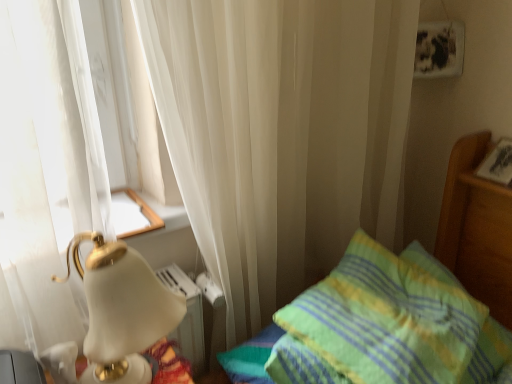
Measure the distance between point (426, 378) and camera.

Point (426, 378) is 33.23 inches from camera.

Identify the location of green/yellow striped pillow at right. Image resolution: width=512 pixels, height=384 pixels. (388, 324).

The width and height of the screenshot is (512, 384). What do you see at coordinates (388, 324) in the screenshot? I see `green/yellow striped pillow at right` at bounding box center [388, 324].

Describe the element at coordinates (121, 307) in the screenshot. The width and height of the screenshot is (512, 384). I see `white glossy lamp at left` at that location.

Find the location of a particular element. The image size is (512, 384). white glossy lamp at left is located at coordinates (121, 307).

You are a GUI agent. You are given a task and a screenshot of the screen. Output one action in this format:
    pyautogui.click(x=<x>, y=<y>)
    Task: Click on the green/yellow striped pillow at right
    This screenshot has height=384, width=512.
    Given the screenshot: What is the action you would take?
    pyautogui.click(x=388, y=324)

Is green/yellow striped pillow at right at the right side of white glossy lamp at left?

Indeed, green/yellow striped pillow at right is positioned on the right side of white glossy lamp at left.

Is green/yellow striped pillow at right further to camera compared to white glossy lamp at left?

Yes, green/yellow striped pillow at right is further from the viewer.

Which is in front, point (460, 374) or point (105, 379)?

The point (105, 379) is in front.

From the image's perspective, does green/yellow striped pillow at right appear lower than white glossy lamp at left?

Yes.

From a real-world perspective, is green/yellow striped pillow at right on top of white glossy lamp at left?

No, from a real-world perspective, green/yellow striped pillow at right is not above white glossy lamp at left.

Considering the sizes of green/yellow striped pillow at right and white glossy lamp at left in the image, is green/yellow striped pillow at right wider or thinner than white glossy lamp at left?

In the image, green/yellow striped pillow at right appears to be wider than white glossy lamp at left.

Between green/yellow striped pillow at right and white glossy lamp at left, which one has less height?

green/yellow striped pillow at right.

Considering the relative sizes of green/yellow striped pillow at right and white glossy lamp at left in the image provided, is green/yellow striped pillow at right bigger than white glossy lamp at left?

Indeed, green/yellow striped pillow at right has a larger size compared to white glossy lamp at left.

Is green/yellow striped pillow at right inside the boundaries of white glossy lamp at left, or outside?

green/yellow striped pillow at right is outside white glossy lamp at left.

Is green/yellow striped pillow at right far away from white glossy lamp at left?

Actually, green/yellow striped pillow at right and white glossy lamp at left are a little close together.

Is green/yellow striped pillow at right positioned with its back to white glossy lamp at left?

No, green/yellow striped pillow at right's orientation is not away from white glossy lamp at left.

Measure the distance from green/yellow striped pillow at right to white glossy lamp at left.

green/yellow striped pillow at right is 18.35 inches from white glossy lamp at left.

In order to click on lamp above the green/yellow striped pillow at right (from the image's perspective) in this screenshot , I will do `click(121, 307)`.

Does white glossy lamp at left appear on the right side of green/yellow striped pillow at right?

Incorrect, white glossy lamp at left is not on the right side of green/yellow striped pillow at right.

Is white glossy lamp at left in front of or behind green/yellow striped pillow at right in the image?

white glossy lamp at left is positioned closer to the viewer than green/yellow striped pillow at right.

Is point (93, 276) farther from viewer compared to point (391, 348)?

No, (93, 276) is in front of (391, 348).

From the image's perspective, is white glossy lamp at left under green/yellow striped pillow at right?

Actually, white glossy lamp at left appears above green/yellow striped pillow at right in the image.

From a real-world perspective, which object rests below the other?

green/yellow striped pillow at right is physically lower.

In the scene shown: Does white glossy lamp at left have a lesser width compared to green/yellow striped pillow at right?

Correct, the width of white glossy lamp at left is less than that of green/yellow striped pillow at right.

Considering the sizes of white glossy lamp at left and green/yellow striped pillow at right in the image, is white glossy lamp at left taller or shorter than green/yellow striped pillow at right?

In the image, white glossy lamp at left appears to be taller than green/yellow striped pillow at right.

Between white glossy lamp at left and green/yellow striped pillow at right, which one has larger size?

With larger size is green/yellow striped pillow at right.

Is white glossy lamp at left surrounding green/yellow striped pillow at right?

No, green/yellow striped pillow at right is located outside of white glossy lamp at left.

Are white glossy lamp at left and green/yellow striped pillow at right far apart?

No, white glossy lamp at left is not far from green/yellow striped pillow at right.

Is white glossy lamp at left aimed at green/yellow striped pillow at right?

No, white glossy lamp at left is not oriented towards green/yellow striped pillow at right.

How far apart are white glossy lamp at left and green/yellow striped pillow at right?

The distance of white glossy lamp at left from green/yellow striped pillow at right is 18.35 inches.

In the image, there is a green/yellow striped pillow at right. At what (x,y) coordinates should I click in order to perform the action: click on lamp above it (from the image's perspective). Please return your answer as a coordinate pair (x, y). Looking at the image, I should click on (121, 307).

At what (x,y) coordinates should I click in order to perform the action: click on pillow below the white glossy lamp at left (from the image's perspective). Please return your answer as a coordinate pair (x, y). This screenshot has height=384, width=512. Looking at the image, I should click on (388, 324).

Where is `lamp located above the green/yellow striped pillow at right (from the image's perspective)`? This screenshot has height=384, width=512. lamp located above the green/yellow striped pillow at right (from the image's perspective) is located at coordinates (121, 307).